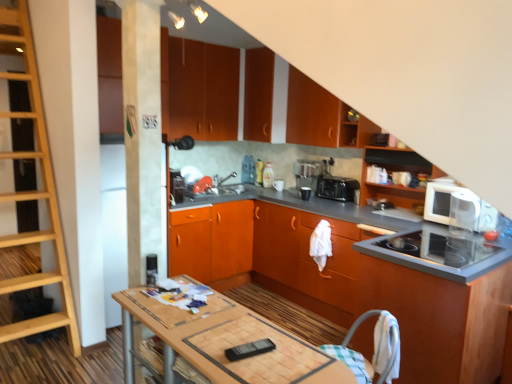
Question: Considering the relative sizes of matte orange cabinet at upper center, which is the 1th cabinetry in top-to-bottom order, and satin black coffee machine at center in the image provided, is matte orange cabinet at upper center, which is the 1th cabinetry in top-to-bottom order, taller than satin black coffee machine at center?

Choices:
 (A) yes
 (B) no

Answer: (A)

Question: Considering the relative sizes of matte orange cabinet at upper center, which is the 1th cabinetry in top-to-bottom order, and satin black coffee machine at center in the image provided, is matte orange cabinet at upper center, which is the 1th cabinetry in top-to-bottom order, shorter than satin black coffee machine at center?

Choices:
 (A) yes
 (B) no

Answer: (B)

Question: Considering the relative positions of matte orange cabinet at upper center, the seventh cabinetry in the bottom-to-top sequence, and satin black coffee machine at center in the image provided, is matte orange cabinet at upper center, the seventh cabinetry in the bottom-to-top sequence, in front of satin black coffee machine at center?

Choices:
 (A) no
 (B) yes

Answer: (B)

Question: From a real-world perspective, does matte orange cabinet at upper center, the seventh cabinetry in the bottom-to-top sequence, sit lower than satin black coffee machine at center?

Choices:
 (A) no
 (B) yes

Answer: (A)

Question: Can you confirm if matte orange cabinet at upper center, which is the 1th cabinetry in top-to-bottom order, is bigger than satin black coffee machine at center?

Choices:
 (A) no
 (B) yes

Answer: (B)

Question: Would you say wooden ladder at left is to the left or to the right of black plastic toaster at center in the picture?

Choices:
 (A) right
 (B) left

Answer: (B)

Question: Considering the positions of point (64, 261) and point (355, 183), is point (64, 261) closer or farther from the camera than point (355, 183)?

Choices:
 (A) farther
 (B) closer

Answer: (B)

Question: From a real-world perspective, relative to black plastic toaster at center, is wooden ladder at left vertically above or below?

Choices:
 (A) above
 (B) below

Answer: (A)

Question: Is wooden ladder at left wider or thinner than black plastic toaster at center?

Choices:
 (A) wide
 (B) thin

Answer: (A)

Question: From the image's perspective, is white glossy microwave at upper right above or below wooden table at center?

Choices:
 (A) above
 (B) below

Answer: (A)

Question: From a real-world perspective, relative to wooden table at center, is white glossy microwave at upper right vertically above or below?

Choices:
 (A) above
 (B) below

Answer: (A)

Question: Considering the positions of white glossy microwave at upper right and wooden table at center in the image, is white glossy microwave at upper right bigger or smaller than wooden table at center?

Choices:
 (A) small
 (B) big

Answer: (A)

Question: Is white glossy microwave at upper right inside the boundaries of wooden table at center, or outside?

Choices:
 (A) inside
 (B) outside

Answer: (B)

Question: Which is correct: white glossy microwave at upper right is inside wooden ladder at left, or outside of it?

Choices:
 (A) inside
 (B) outside

Answer: (B)

Question: In the image, is white glossy microwave at upper right positioned in front of or behind wooden ladder at left?

Choices:
 (A) behind
 (B) front

Answer: (A)